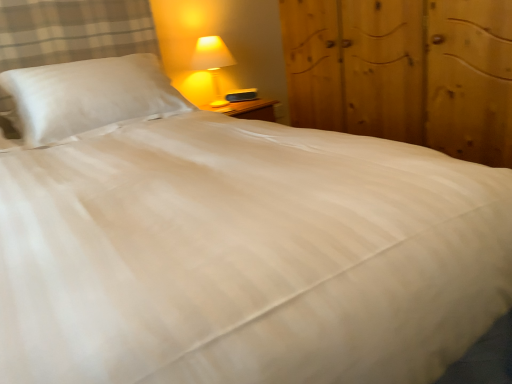
What are the coordinates of `wooden dresser at right` in the screenshot? It's located at (405, 72).

Does point (216, 77) come closer to viewer compared to point (180, 99)?

No, (216, 77) is further to viewer.

From the image's perspective, would you say matte yellow plastic lamp at upper right is positioned over white satin pillow at upper left?

Yes, from the image's perspective, matte yellow plastic lamp at upper right is on top of white satin pillow at upper left.

Is matte yellow plastic lamp at upper right next to white satin pillow at upper left?

They are not placed beside each other.

Which object is positioned more to the right, matte yellow plastic lamp at upper right or wooden dresser at right?

Positioned to the right is wooden dresser at right.

From the image's perspective, relative to wooden dresser at right, is matte yellow plastic lamp at upper right above or below?

matte yellow plastic lamp at upper right is situated higher than wooden dresser at right in the image.

Consider the image. Which is correct: matte yellow plastic lamp at upper right is inside wooden dresser at right, or outside of it?

matte yellow plastic lamp at upper right cannot be found inside wooden dresser at right.

Is there a large distance between matte yellow plastic lamp at upper right and wooden dresser at right?

No, there isn't a large distance between matte yellow plastic lamp at upper right and wooden dresser at right.

In order to click on pillow on the left of wooden dresser at right in this screenshot , I will do `click(89, 95)`.

Is point (387, 12) farther from viewer compared to point (119, 114)?

No, (387, 12) is closer to viewer.

From a real-world perspective, which is physically below, wooden dresser at right or white satin pillow at upper left?

wooden dresser at right is physically lower.

From the image's perspective, which one is positioned higher, wooden dresser at right or white satin pillow at upper left?

wooden dresser at right.

Which object is closer to the camera taking this photo, wooden dresser at right or matte yellow plastic lamp at upper right?

wooden dresser at right is more forward.

From the picture: From the image's perspective, which object appears higher, wooden dresser at right or matte yellow plastic lamp at upper right?

matte yellow plastic lamp at upper right appears higher in the image.

Looking at this image, can we say wooden dresser at right lies outside matte yellow plastic lamp at upper right?

wooden dresser at right lies outside matte yellow plastic lamp at upper right's area.

How many degrees apart are the facing directions of wooden dresser at right and matte yellow plastic lamp at upper right?

The facing directions of wooden dresser at right and matte yellow plastic lamp at upper right are 89.7 degrees apart.

Does white satin pillow at upper left have a greater height compared to wooden dresser at right?

No.

Is white satin pillow at upper left wider than wooden dresser at right?

Incorrect, the width of white satin pillow at upper left does not surpass that of wooden dresser at right.

Is white satin pillow at upper left behind wooden dresser at right?

Yes, white satin pillow at upper left is further from the viewer.

Is white satin pillow at upper left aimed at wooden dresser at right?

No, white satin pillow at upper left is not aimed at wooden dresser at right.

Is white satin pillow at upper left positioned before matte yellow plastic lamp at upper right?

Yes, the depth of white satin pillow at upper left is less than that of matte yellow plastic lamp at upper right.

Is matte yellow plastic lamp at upper right completely or partially inside white satin pillow at upper left?

Definitely not — matte yellow plastic lamp at upper right is not inside white satin pillow at upper left.

Looking at this image, considering the positions of objects white satin pillow at upper left and matte yellow plastic lamp at upper right in the image provided, who is more to the right, white satin pillow at upper left or matte yellow plastic lamp at upper right?

matte yellow plastic lamp at upper right.

Find the location of a particular element. This screenshot has width=512, height=384. pillow that is in front of the matte yellow plastic lamp at upper right is located at coordinates (89, 95).

At what (x,y) coordinates should I click in order to perform the action: click on lamp positioned vertically above the wooden dresser at right (from a real-world perspective). Please return your answer as a coordinate pair (x, y). Looking at the image, I should click on (213, 63).

Considering their positions, is matte yellow plastic lamp at upper right positioned further to white satin pillow at upper left than wooden dresser at right?

wooden dresser at right is further to white satin pillow at upper left.

Looking at the image, which one is located further to matte yellow plastic lamp at upper right, white satin pillow at upper left or wooden dresser at right?

wooden dresser at right is further to matte yellow plastic lamp at upper right.

Based on the photo, when comparing their distances from white satin pillow at upper left, does wooden dresser at right or matte yellow plastic lamp at upper right seem closer?

matte yellow plastic lamp at upper right is closer to white satin pillow at upper left.

Which object lies further to the anchor point wooden dresser at right, white satin pillow at upper left or matte yellow plastic lamp at upper right?

Among the two, white satin pillow at upper left is located further to wooden dresser at right.

From the image, which object appears to be farther from wooden dresser at right, matte yellow plastic lamp at upper right or white satin pillow at upper left?

The object further to wooden dresser at right is white satin pillow at upper left.

Which object lies nearer to the anchor point matte yellow plastic lamp at upper right, wooden dresser at right or white satin pillow at upper left?

Based on the image, white satin pillow at upper left appears to be nearer to matte yellow plastic lamp at upper right.

The image size is (512, 384). In order to click on lamp between white satin pillow at upper left and wooden dresser at right from left to right in this screenshot , I will do `click(213, 63)`.